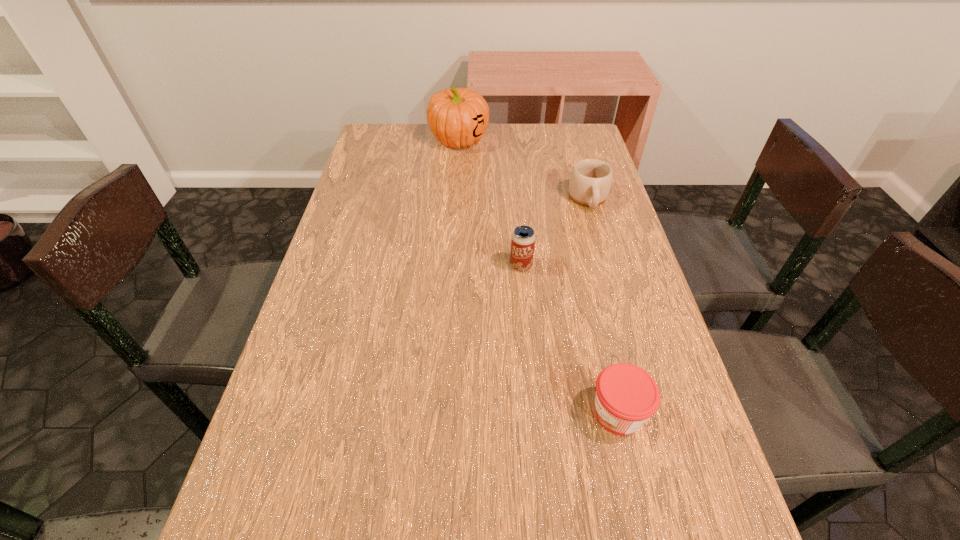
The width and height of the screenshot is (960, 540). What are the coordinates of `empty location between the third object from right to left and the jam` in the screenshot? It's located at (569, 339).

At what (x,y) coordinates should I click in order to perform the action: click on free space between the jam and the farthest object. Please return your answer as a coordinate pair (x, y). This screenshot has width=960, height=540. Looking at the image, I should click on (539, 276).

The height and width of the screenshot is (540, 960). Find the location of `vacant point located between the mug and the beer can`. vacant point located between the mug and the beer can is located at coordinates (555, 232).

At what (x,y) coordinates should I click in order to perform the action: click on free space between the nearest object and the leftmost object. Please return your answer as a coordinate pair (x, y). Looking at the image, I should click on (539, 276).

You are a GUI agent. You are given a task and a screenshot of the screen. Output one action in this format:
    pyautogui.click(x=<x>, y=<y>)
    Task: Click on the vacant area that lies between the third object from right to left and the tallest object
    The image size is (960, 540).
    Given the screenshot: What is the action you would take?
    pyautogui.click(x=490, y=202)

Where is `free point between the second nearest object and the nearest object`? The width and height of the screenshot is (960, 540). free point between the second nearest object and the nearest object is located at coordinates (569, 339).

This screenshot has height=540, width=960. What are the coordinates of `empty space that is in between the jam and the third nearest object` in the screenshot? It's located at (603, 306).

The width and height of the screenshot is (960, 540). I want to click on free space that is in between the jam and the pumpkin, so click(x=539, y=276).

The image size is (960, 540). I want to click on vacant point located between the jam and the beer can, so (x=569, y=339).

Choose which object is the nearest neighbor to the second farthest object. Please provide its 2D coordinates. Your answer should be formatted as a tuple, i.e. [(x, y)], where the tuple contains the x and y coordinates of a point satisfying the conditions above.

[(523, 238)]